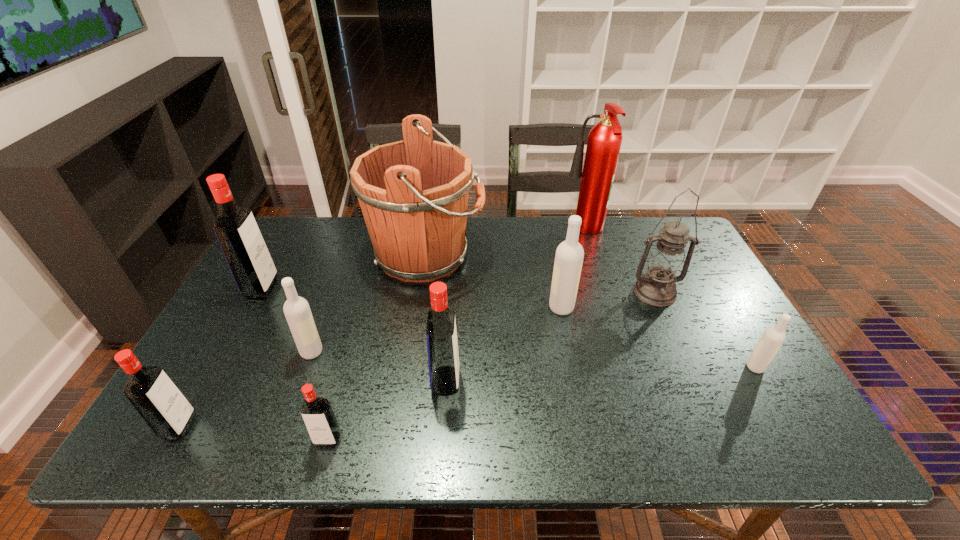
This screenshot has height=540, width=960. Identify the location of free spot that satisfies the following two spatial constraints: 1. with the handle on the side of the bucket; 2. on the left side of the gray oil lamp. (x=421, y=292).